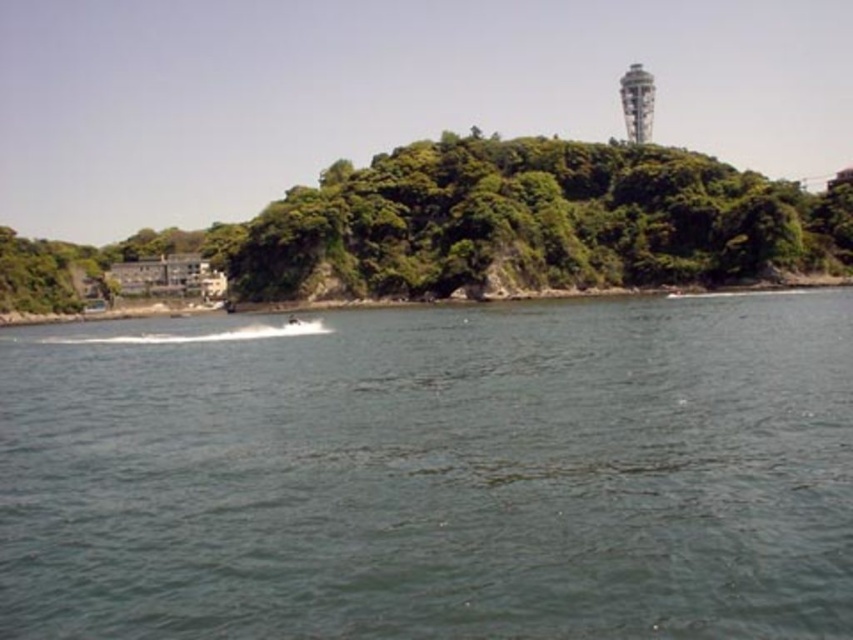
Question: In this image, where is green leafy trees at center located relative to white concrete tower at upper center?

Choices:
 (A) right
 (B) left

Answer: (B)

Question: Which point is closer to the camera taking this photo?

Choices:
 (A) (500, 531)
 (B) (624, 86)
 (C) (566, 141)

Answer: (A)

Question: Which point is closer to the camera?

Choices:
 (A) (55, 244)
 (B) (357, 593)

Answer: (B)

Question: Is dark blue water at center further to camera compared to green leafy trees at center?

Choices:
 (A) yes
 (B) no

Answer: (B)

Question: Which point is farther from the camera taking this photo?

Choices:
 (A) (212, 253)
 (B) (643, 104)

Answer: (B)

Question: Does dark blue water at center have a smaller size compared to green leafy trees at center?

Choices:
 (A) no
 (B) yes

Answer: (B)